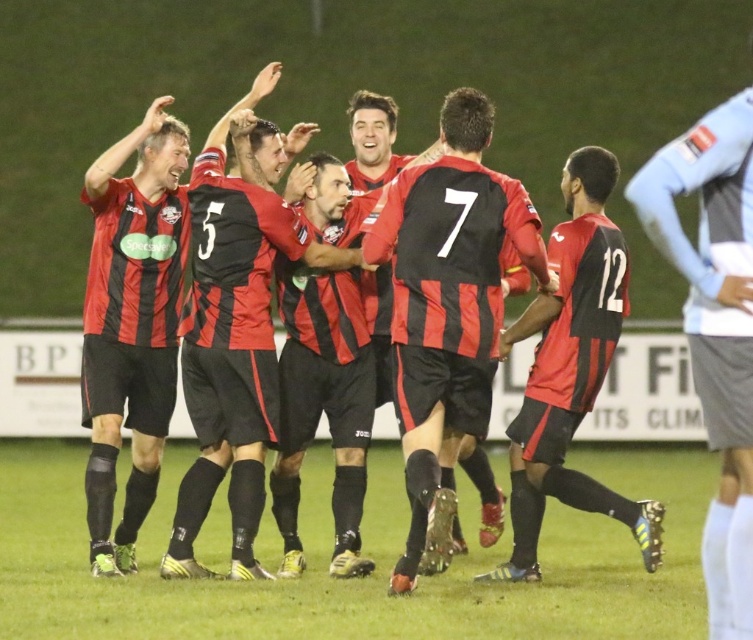
You are a photographer standing at the edge of the soccer field. You want to take a photo of two specific points marked on the field. The first point is at coordinates point (413, 243) and the second point is at point (561, 182). Which point will appear larger in your photo?

Point (413, 243) is closer to the viewer than point (561, 182), so it will appear larger in the photo.

You are a photographer at the soccer field. You want to take a photo of the light blue jersey at upper right without the matte red and black jersey at center blocking it. What should you do?

The light blue jersey at upper right is behind the matte red and black jersey at center, so you should move to a position where the light blue jersey at upper right is in front of the matte red and black jersey at center or adjust your angle to avoid the obstruction.